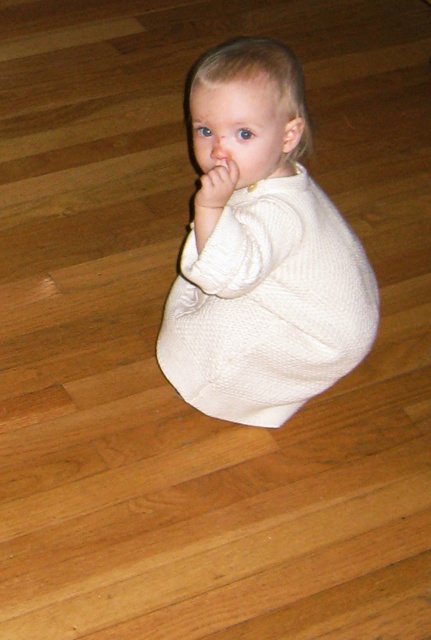
Who is more forward, (214, 168) or (202, 186)?

Point (202, 186) is in front.

Between white matte hand at center and smooth cream skin at center, which one has more height?

white matte hand at center

Which is in front, point (196, 209) or point (231, 182)?

Point (231, 182) is more forward.

Identify the location of white matte hand at center. (215, 186).

Who is shorter, white knitted sweater at center or white matte hand at center?

white matte hand at center

From the picture: Between white knitted sweater at center and white matte hand at center, which one has more height?

white knitted sweater at center is taller.

Is point (275, 416) less distant than point (221, 180)?

That is False.

Locate an element on the screen. white knitted sweater at center is located at coordinates (262, 253).

Is white knitted sweater at center closer to camera compared to smooth cream skin at center?

Yes, it is.

Who is higher up, white knitted sweater at center or smooth cream skin at center?

smooth cream skin at center is above.

This screenshot has height=640, width=431. In order to click on white knitted sweater at center in this screenshot , I will do `click(262, 253)`.